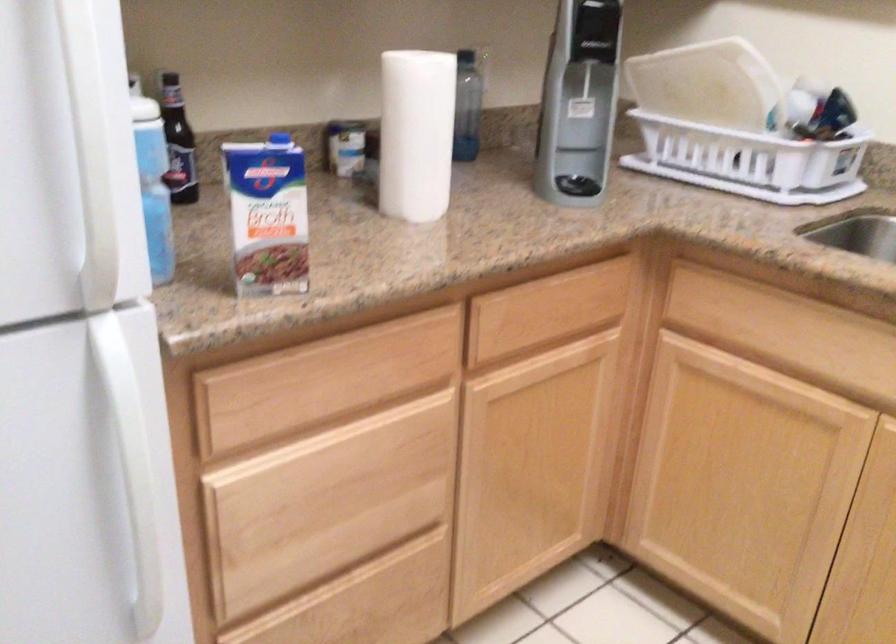
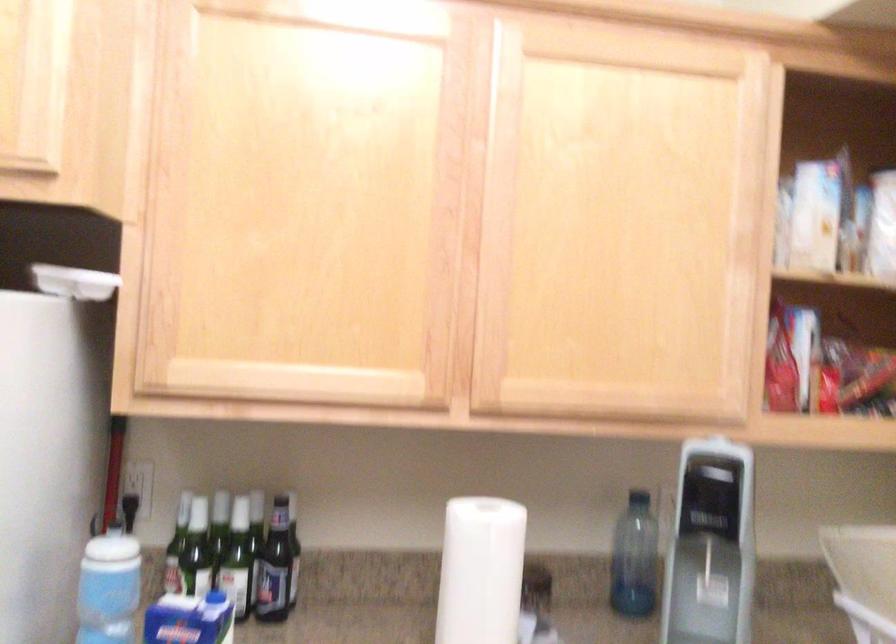
Question: I am providing you with two images of the same scene from different viewpoints. After the viewpoint changes to image2, which objects are now occluded?

Choices:
 (A) white paper towel roll
 (B) blue carton cap
 (C) dark glass bottle
 (D) none of these

Answer: (D)